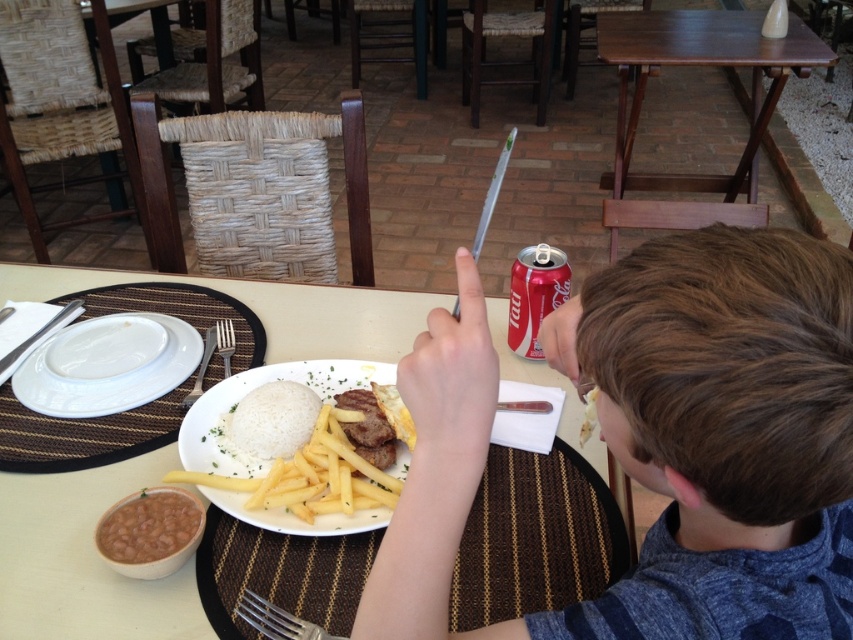
Between point (337, 502) and point (148, 509), which one is positioned in front?

Positioned in front is point (148, 509).

Based on the photo, between yellow fried french fries at center and brown matte beans at lower left, which one is positioned higher?

yellow fried french fries at center is higher up.

Who is more forward, (195, 420) or (167, 504)?

Point (167, 504)

You are a GUI agent. You are given a task and a screenshot of the screen. Output one action in this format:
    pyautogui.click(x=<x>, y=<y>)
    Task: Click on the yellow fried french fries at center
    
    Given the screenshot: What is the action you would take?
    pyautogui.click(x=285, y=458)

Does brown matte beans at lower left come behind red matte can at upper right?

No, it is not.

Is the position of brown matte beans at lower left less distant than that of red matte can at upper right?

Yes, it is in front of red matte can at upper right.

Locate an element on the screen. This screenshot has height=640, width=853. brown matte beans at lower left is located at coordinates (149, 529).

The height and width of the screenshot is (640, 853). What do you see at coordinates (659, 442) in the screenshot?
I see `brown hair at upper right` at bounding box center [659, 442].

Image resolution: width=853 pixels, height=640 pixels. Identify the location of brown hair at upper right. (659, 442).